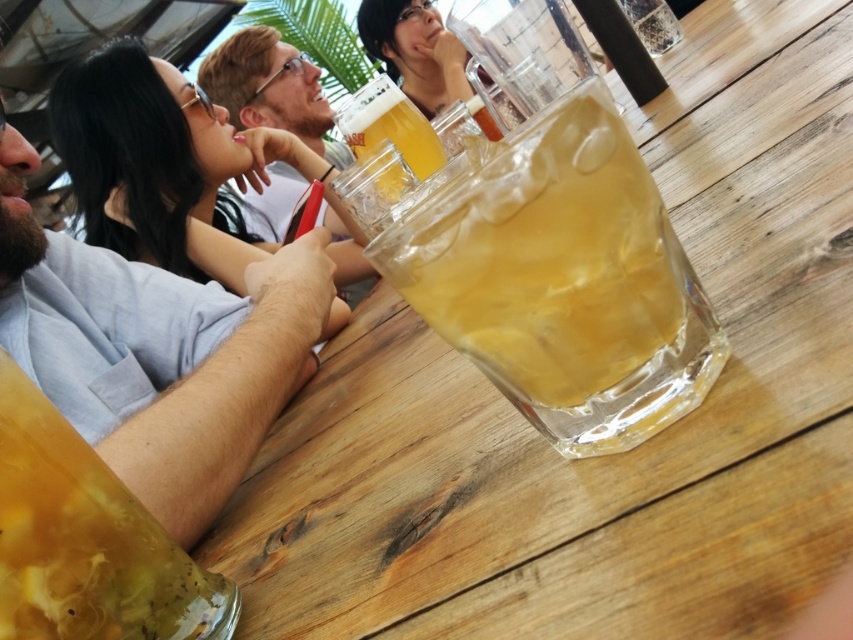
Who is higher up, translucent glass at center or translucent yellow liquid at lower left?

Positioned higher is translucent glass at center.

Does translucent glass at center have a lesser width compared to translucent yellow liquid at lower left?

In fact, translucent glass at center might be wider than translucent yellow liquid at lower left.

Where is `translucent glass at center`? translucent glass at center is located at coordinates click(x=544, y=259).

Where is `translucent yellow liquid at lower left`? The height and width of the screenshot is (640, 853). translucent yellow liquid at lower left is located at coordinates (86, 540).

Locate an element on the screen. This screenshot has width=853, height=640. translucent yellow liquid at lower left is located at coordinates (86, 540).

Which is more to the right, matte white shirt at upper center or translucent glass mug at center?

translucent glass mug at center

Does matte white shirt at upper center have a greater width compared to translucent glass mug at center?

Indeed, matte white shirt at upper center has a greater width compared to translucent glass mug at center.

Is point (270, 81) behind point (378, 118)?

That is True.

You are a GUI agent. You are given a task and a screenshot of the screen. Output one action in this format:
    pyautogui.click(x=<x>, y=<y>)
    Task: Click on the matte white shirt at upper center
    
    Given the screenshot: What is the action you would take?
    pyautogui.click(x=270, y=88)